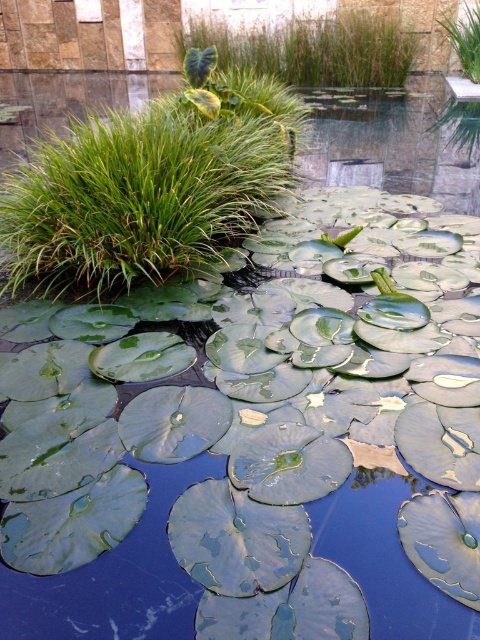
Question: Is green leafy grass at upper center above green glossy lily pad at upper center?

Choices:
 (A) yes
 (B) no

Answer: (A)

Question: From the image, what is the correct spatial relationship of green leafy grass at upper left in relation to green leafy grass at upper center?

Choices:
 (A) right
 (B) left

Answer: (B)

Question: Which point appears closest to the camera in this image?

Choices:
 (A) (479, 35)
 (B) (124, 218)

Answer: (B)

Question: Does green leafy grass at upper left have a greater width compared to green glossy lily pad at upper center?

Choices:
 (A) yes
 (B) no

Answer: (B)

Question: Estimate the real-world distances between objects in this image. Which object is farther from the green leafy grass at upper center?

Choices:
 (A) green glossy lily pad at upper center
 (B) green leafy grass at upper left

Answer: (B)

Question: Which object is the farthest from the green glossy lily pad at upper center?

Choices:
 (A) green leafy grass at upper center
 (B) green leafy grass at upper left

Answer: (B)